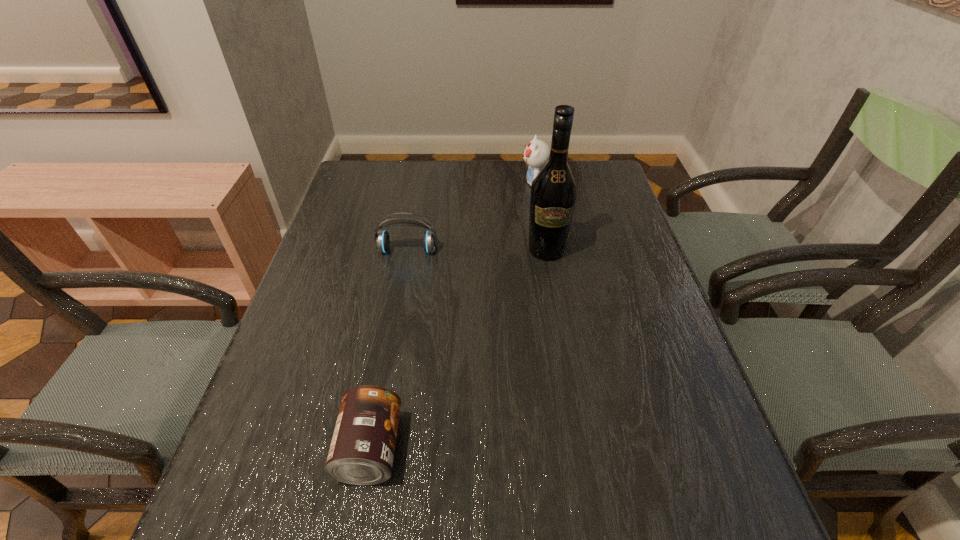
The width and height of the screenshot is (960, 540). Identify the location of free point between the headset and the nearest object. (389, 349).

This screenshot has height=540, width=960. Find the location of `free spot between the can and the farthest object`. free spot between the can and the farthest object is located at coordinates (452, 315).

This screenshot has width=960, height=540. I want to click on vacant space that's between the headset and the can, so click(x=389, y=349).

This screenshot has width=960, height=540. Find the location of `unoccupied position between the wine bottle and the headset`. unoccupied position between the wine bottle and the headset is located at coordinates (477, 250).

The image size is (960, 540). What are the coordinates of `empty location between the farthest object and the headset` in the screenshot? It's located at (470, 217).

I want to click on unoccupied position between the wine bottle and the can, so click(458, 349).

At what (x,y) coordinates should I click in order to perform the action: click on vacant space in between the can and the tallest object. Please return your answer as a coordinate pair (x, y). This screenshot has height=540, width=960. Looking at the image, I should click on (458, 349).

Find the location of a particular element. vacant space that is in between the third shortest object and the headset is located at coordinates (x=470, y=217).

Identify the location of the third closest object relative to the headset. This screenshot has width=960, height=540. (362, 449).

Locate an element on the screen. The height and width of the screenshot is (540, 960). object that stands as the closest to the second tallest object is located at coordinates (553, 196).